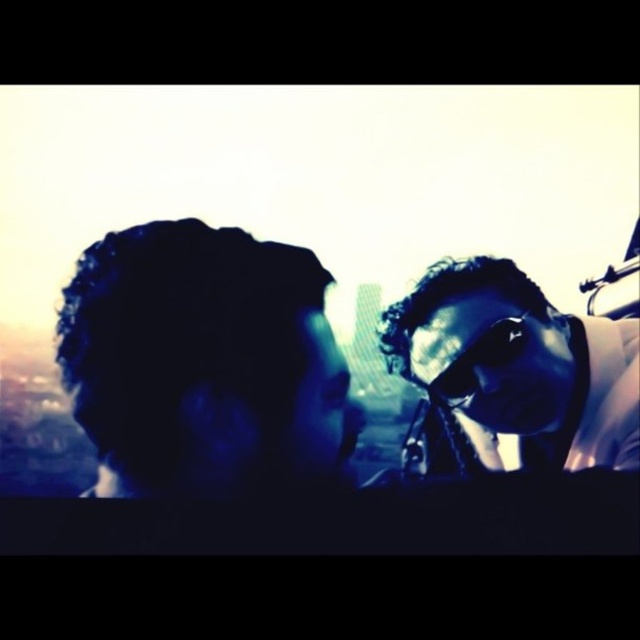
Is point (253, 440) positioned behind point (492, 371)?

No, it is in front of (492, 371).

Does point (243, 400) come closer to viewer compared to point (534, 444)?

Yes, it is.

What do you see at coordinates (204, 362) in the screenshot?
I see `dark curly hair at left` at bounding box center [204, 362].

You are a GUI agent. You are given a task and a screenshot of the screen. Output one action in this format:
    pyautogui.click(x=<x>, y=<y>)
    Task: Click on the dark curly hair at left
    
    Given the screenshot: What is the action you would take?
    tap(204, 362)

Is dark curly hair at left closer to camera compared to shiny black goggles at center?

Yes, it is.

Can you confirm if dark curly hair at left is bigger than shiny black goggles at center?

Yes.

Which is in front, point (237, 360) or point (417, 358)?

Point (237, 360)

Where is `dark curly hair at left`? Image resolution: width=640 pixels, height=640 pixels. dark curly hair at left is located at coordinates (204, 362).

Does sunglasses at center appear on the right side of shiny black goggles at center?

Yes, sunglasses at center is to the right of shiny black goggles at center.

Can you confirm if sunglasses at center is positioned below shiny black goggles at center?

Incorrect, sunglasses at center is not positioned below shiny black goggles at center.

Between point (612, 380) and point (557, 355), which one is positioned in front?

Positioned in front is point (557, 355).

Where is `sunglasses at center`? sunglasses at center is located at coordinates (516, 365).